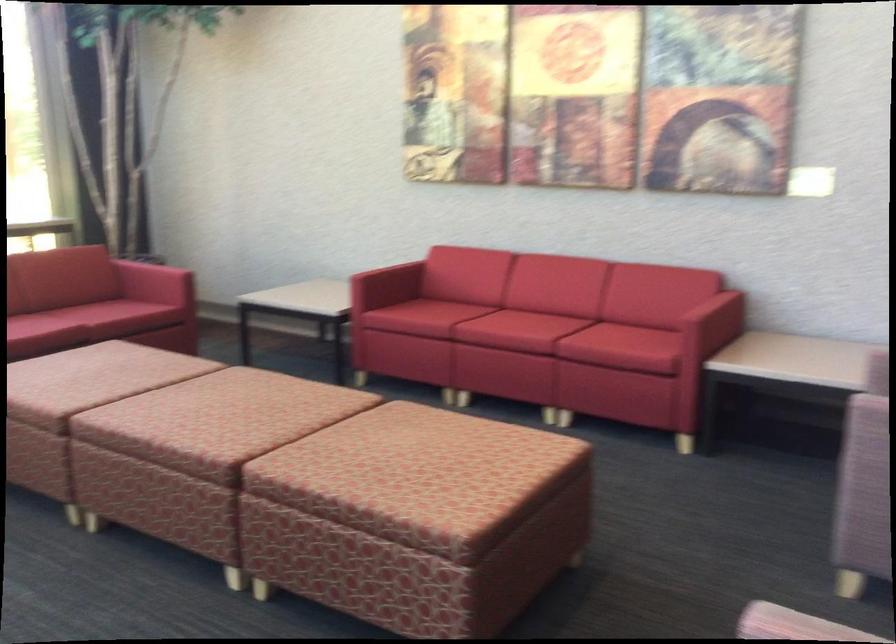
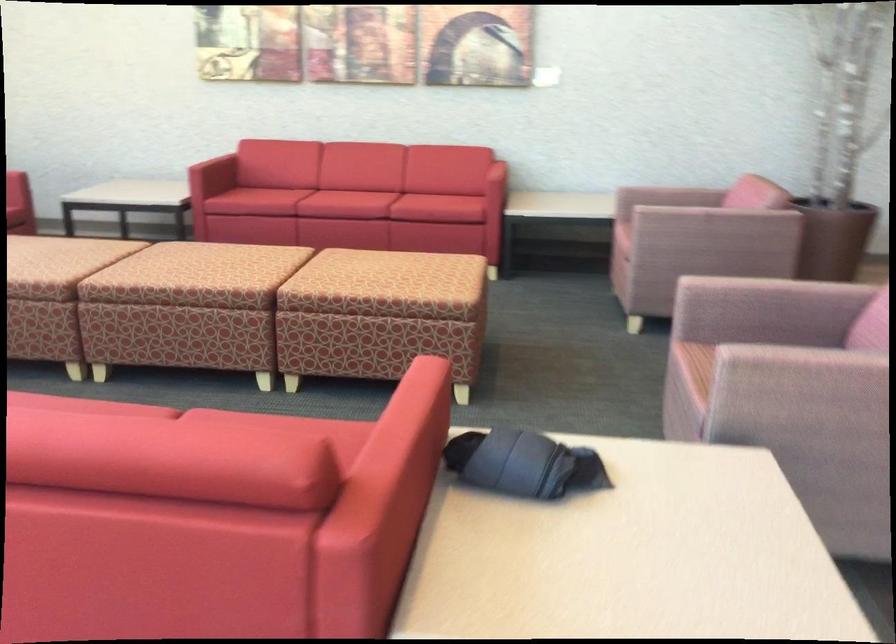
Locate, in the second image, the point that corresponds to pixel 207 417 in the first image.

(186, 263)